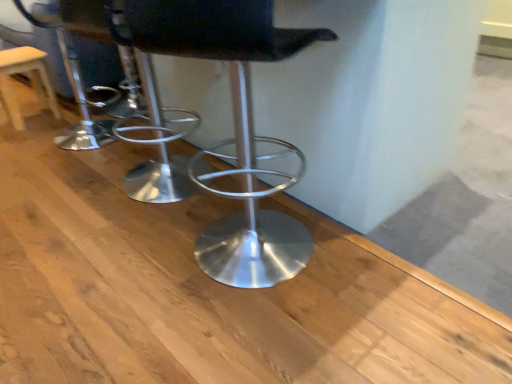
Question: Should I look upward or downward to see metallic silver stool at center?

Choices:
 (A) down
 (B) up

Answer: (B)

Question: Is metallic silver stool at center wider than wooden stool at left?

Choices:
 (A) no
 (B) yes

Answer: (B)

Question: From a real-world perspective, is metallic silver stool at center located beneath wooden stool at left?

Choices:
 (A) yes
 (B) no

Answer: (B)

Question: Can you see metallic silver stool at center touching wooden stool at left?

Choices:
 (A) no
 (B) yes

Answer: (A)

Question: Is metallic silver stool at center not near wooden stool at left?

Choices:
 (A) no
 (B) yes

Answer: (B)

Question: Is metallic silver stool at center further to the viewer compared to wooden stool at left?

Choices:
 (A) no
 (B) yes

Answer: (A)

Question: Considering the relative sizes of metallic silver stool at center and wooden stool at left in the image provided, is metallic silver stool at center bigger than wooden stool at left?

Choices:
 (A) no
 (B) yes

Answer: (B)

Question: Considering the relative sizes of wooden stool at left and metallic silver stool at center in the image provided, is wooden stool at left wider than metallic silver stool at center?

Choices:
 (A) no
 (B) yes

Answer: (A)

Question: Is wooden stool at left far from metallic silver stool at center?

Choices:
 (A) no
 (B) yes

Answer: (B)

Question: From the image's perspective, is wooden stool at left located beneath metallic silver stool at center?

Choices:
 (A) no
 (B) yes

Answer: (A)

Question: Considering the relative sizes of wooden stool at left and metallic silver stool at center in the image provided, is wooden stool at left smaller than metallic silver stool at center?

Choices:
 (A) yes
 (B) no

Answer: (A)

Question: From a real-world perspective, is wooden stool at left on metallic silver stool at center?

Choices:
 (A) no
 (B) yes

Answer: (A)

Question: Is wooden stool at left further to camera compared to metallic silver stool at center?

Choices:
 (A) yes
 (B) no

Answer: (A)

Question: Based on their sizes in the image, would you say metallic silver stool at center is bigger or smaller than wooden stool at left?

Choices:
 (A) big
 (B) small

Answer: (A)